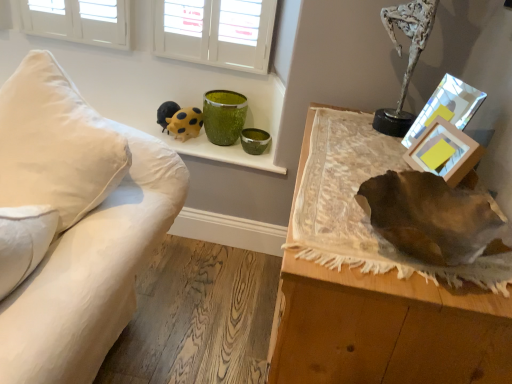
Question: From the image's perspective, is white fabric couch at left positioned above or below leather at right?

Choices:
 (A) below
 (B) above

Answer: (B)

Question: From a real-world perspective, is white fabric couch at left positioned above or below leather at right?

Choices:
 (A) above
 (B) below

Answer: (B)

Question: Which object is positioned closest to the metallic reflective frame at upper right, which appears as the 1th picture frame when viewed from the back?

Choices:
 (A) leather at right
 (B) green speckled glass vase at upper center
 (C) yellow dotted plush at upper center
 (D) white fabric couch at left
 (E) wooden picture frame at upper right, acting as the 1th picture frame starting from the front

Answer: (E)

Question: Which object is the closest to the yellow dotted plush at upper center?

Choices:
 (A) white fabric couch at left
 (B) wooden picture frame at upper right, acting as the 2th picture frame starting from the back
 (C) green speckled glass vase at upper center
 (D) leather at right
 (E) metallic reflective frame at upper right, the 2th picture frame from the front

Answer: (C)